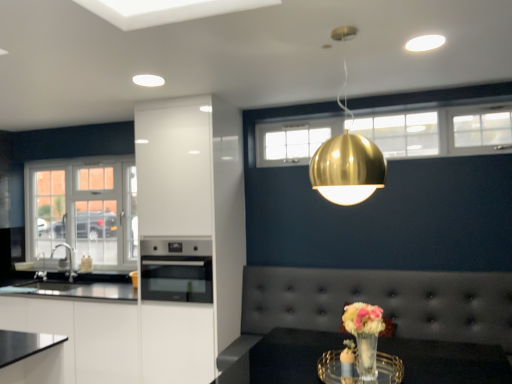
Question: Could you tell me if stainless steel oven at center is turned towards gold metallic sphere at upper center?

Choices:
 (A) no
 (B) yes

Answer: (A)

Question: Considering the relative sizes of stainless steel oven at center and gold metallic sphere at upper center in the image provided, is stainless steel oven at center thinner than gold metallic sphere at upper center?

Choices:
 (A) no
 (B) yes

Answer: (A)

Question: Is stainless steel oven at center shorter than gold metallic sphere at upper center?

Choices:
 (A) no
 (B) yes

Answer: (B)

Question: Can you confirm if stainless steel oven at center is positioned to the left of gold metallic sphere at upper center?

Choices:
 (A) yes
 (B) no

Answer: (A)

Question: Considering the relative sizes of stainless steel oven at center and gold metallic sphere at upper center in the image provided, is stainless steel oven at center wider than gold metallic sphere at upper center?

Choices:
 (A) yes
 (B) no

Answer: (A)

Question: From the image's perspective, would you say stainless steel oven at center is positioned over gold metallic sphere at upper center?

Choices:
 (A) no
 (B) yes

Answer: (A)

Question: Does white glossy cabinet at center have a lesser width compared to gold metallic sphere at upper center?

Choices:
 (A) yes
 (B) no

Answer: (B)

Question: Is white glossy cabinet at center positioned in front of gold metallic sphere at upper center?

Choices:
 (A) yes
 (B) no

Answer: (B)

Question: Can you confirm if white glossy cabinet at center is wider than gold metallic sphere at upper center?

Choices:
 (A) no
 (B) yes

Answer: (B)

Question: Is white glossy cabinet at center next to gold metallic sphere at upper center and touching it?

Choices:
 (A) no
 (B) yes

Answer: (A)

Question: Is white glossy cabinet at center oriented towards gold metallic sphere at upper center?

Choices:
 (A) yes
 (B) no

Answer: (B)

Question: Does white glossy cabinet at center have a larger size compared to gold metallic sphere at upper center?

Choices:
 (A) yes
 (B) no

Answer: (A)

Question: Is stainless steel oven at center oriented towards white glass window at left?

Choices:
 (A) no
 (B) yes

Answer: (A)